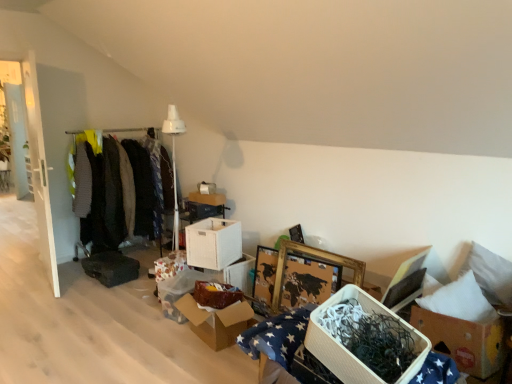
Question: From the image's perspective, relative to white cardboard box at center, which ranks as the second storage box in back-to-front order, is matte cardboard box at center, the second storage box when ordered from front to back, above or below?

Choices:
 (A) above
 (B) below

Answer: (B)

Question: Looking at the image, does matte cardboard box at center, the second storage box when ordered from front to back, seem bigger or smaller compared to white cardboard box at center, which ranks as the fifth storage box in front-to-back order?

Choices:
 (A) big
 (B) small

Answer: (A)

Question: Based on their relative distances, which object is farther from the matte cardboard box at center, the fifth storage box when ordered from back to front?

Choices:
 (A) white cardboard box at center, which ranks as the second storage box in back-to-front order
 (B) white cardboard box at lower right, arranged as the 2th cardboard box when viewed from the left
 (C) white cardboard box at center, arranged as the fourth storage box when viewed from the back
 (D) knit sweater at left, marked as the 2th clothing in a left-to-right arrangement
 (E) white cardboard storage box at center, marked as the first storage box in a back-to-front arrangement

Answer: (B)

Question: Which of these objects is positioned closest to the cardboard box at center, marked as the first cardboard box in a back-to-front arrangement?

Choices:
 (A) white cardboard storage box at lower right, arranged as the 1th storage box when viewed from the front
 (B) knit sweater at left, which is the second clothing in right-to-left order
 (C) white cardboard box at center, arranged as the fourth storage box when viewed from the back
 (D) dark green fabric at left, acting as the 3th clothing starting from the right
 (E) white cardboard storage box at center, marked as the first storage box in a back-to-front arrangement

Answer: (C)